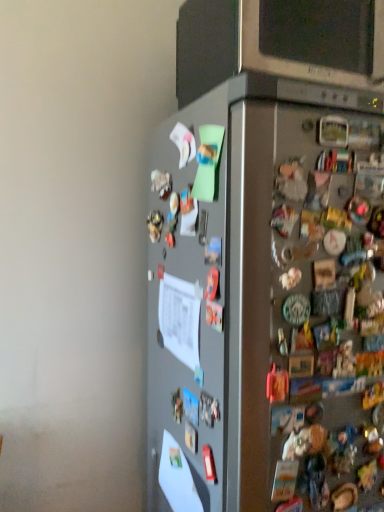
Where is `satin silver refrigerator at upper right`? satin silver refrigerator at upper right is located at coordinates (267, 300).

This screenshot has width=384, height=512. What do you see at coordinates (267, 300) in the screenshot? I see `satin silver refrigerator at upper right` at bounding box center [267, 300].

This screenshot has height=512, width=384. I want to click on satin silver refrigerator at upper right, so click(267, 300).